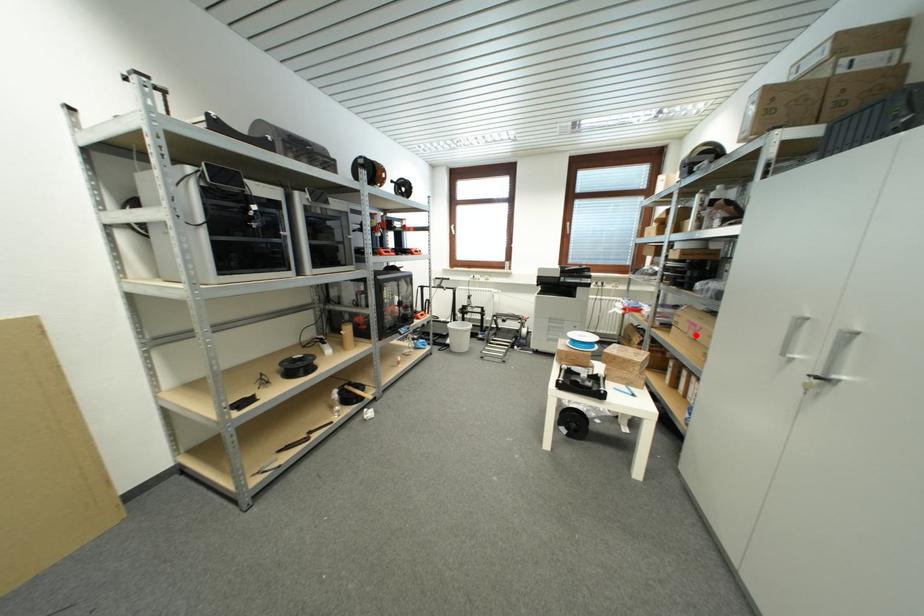
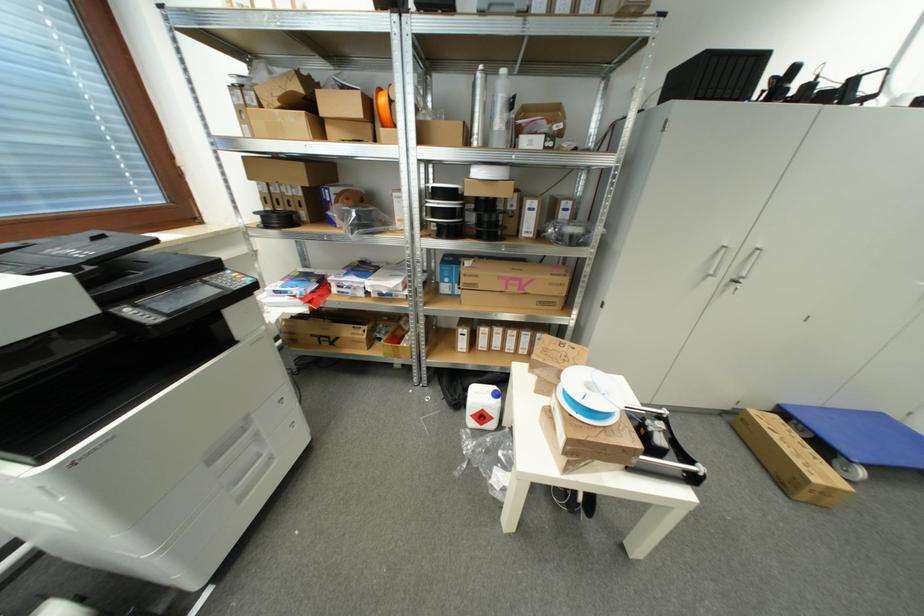
Where in the second image is the point corresponding to the highlighted location from the first image?

(517, 292)